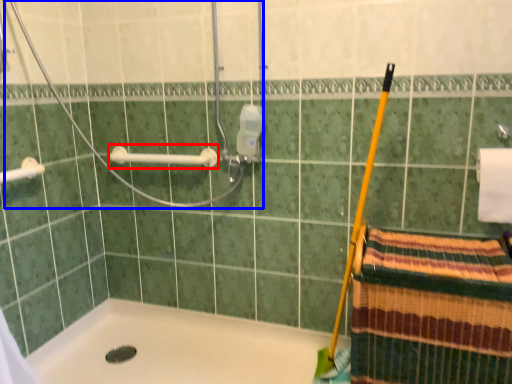
Question: Which of the following is the farthest to the observer, towel bar (highlighted by a red box) or shower (highlighted by a blue box)?

Choices:
 (A) towel bar
 (B) shower

Answer: (A)